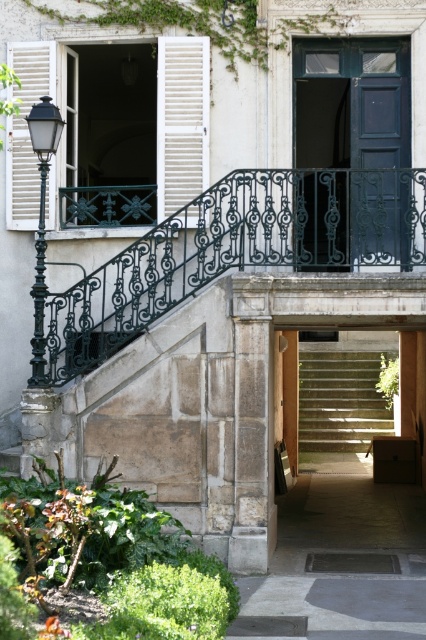
You are an architect inspecting a building facade. You notice two white wooden shutters at upper left and a white wooden shutter at left. Which one has a bigger size?

The white wooden shutters at upper left is larger in size than the white wooden shutter at left.

From the picture: You are a painter who needs to decide which object to paint first. The dark blue wood door at center and the white wooden shutters at upper left are both in your view. Based on their sizes, which one should you tackle first if you want to start with the bigger object?

The dark blue wood door at center is larger in size than the white wooden shutters at upper left, so you should start painting the dark blue wood door at center first.

You are a painter who needs to decide which object to paint first. If you want to paint the wider object first, which one should you choose between the dark blue wood door at center and the white wooden shutters at upper left?

The dark blue wood door at center is wider than the white wooden shutters at upper left, so you should paint the dark blue wood door at center first.